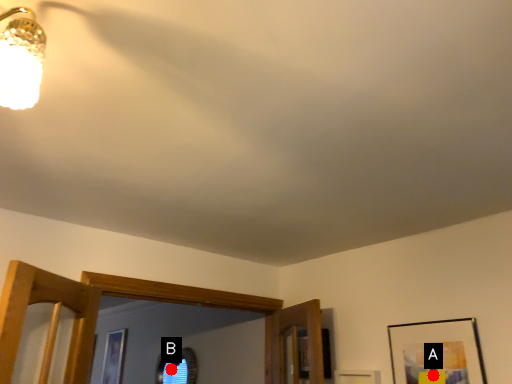
Question: Two points are circled on the image, labeled by A and B beside each circle. Among these points, which one is nearest to the camera?

Choices:
 (A) A is closer
 (B) B is closer

Answer: (A)